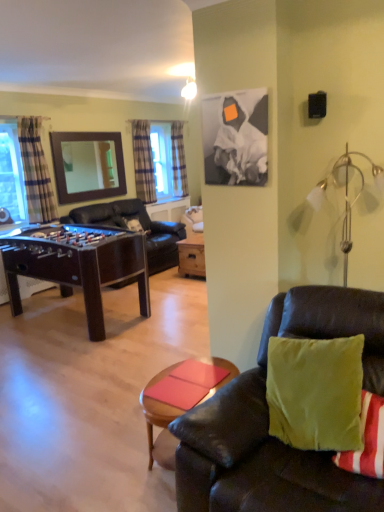
Question: Is plaid fabric curtain at center, positioned as the 2th curtain in back-to-front order, far away from mahogany wood foosball table at left?

Choices:
 (A) yes
 (B) no

Answer: (A)

Question: Does plaid fabric curtain at center, positioned as the 2th curtain in back-to-front order, lie behind mahogany wood foosball table at left?

Choices:
 (A) no
 (B) yes

Answer: (B)

Question: Does plaid fabric curtain at center, positioned as the 2th curtain in back-to-front order, contain mahogany wood foosball table at left?

Choices:
 (A) no
 (B) yes

Answer: (A)

Question: Can you confirm if plaid fabric curtain at center, marked as the second curtain in a front-to-back arrangement, is positioned to the left of mahogany wood foosball table at left?

Choices:
 (A) no
 (B) yes

Answer: (A)

Question: From the image's perspective, does plaid fabric curtain at center, the second curtain in the left-to-right sequence, appear lower than mahogany wood foosball table at left?

Choices:
 (A) no
 (B) yes

Answer: (A)

Question: Is wooden mirror at upper left wider or thinner than dark brown leather couch at center, acting as the 1th studio couch starting from the back?

Choices:
 (A) thin
 (B) wide

Answer: (A)

Question: Looking at the image, does wooden mirror at upper left seem bigger or smaller compared to dark brown leather couch at center, positioned as the second studio couch in front-to-back order?

Choices:
 (A) small
 (B) big

Answer: (A)

Question: Considering the positions of point (119, 178) and point (145, 221), is point (119, 178) closer or farther from the camera than point (145, 221)?

Choices:
 (A) closer
 (B) farther

Answer: (B)

Question: From a real-world perspective, relative to dark brown leather couch at center, acting as the 1th studio couch starting from the back, is wooden mirror at upper left vertically above or below?

Choices:
 (A) above
 (B) below

Answer: (A)

Question: Considering their positions, is clear glass window at left located in front of or behind smooth wooden coffee table at lower center?

Choices:
 (A) front
 (B) behind

Answer: (B)

Question: Considering the positions of clear glass window at left and smooth wooden coffee table at lower center in the image, is clear glass window at left wider or thinner than smooth wooden coffee table at lower center?

Choices:
 (A) thin
 (B) wide

Answer: (A)

Question: From the image's perspective, is clear glass window at left positioned above or below smooth wooden coffee table at lower center?

Choices:
 (A) above
 (B) below

Answer: (A)

Question: Is point (1, 154) positioned closer to the camera than point (140, 403)?

Choices:
 (A) closer
 (B) farther

Answer: (B)

Question: From the image's perspective, is wooden mirror at upper left located above or below white glass lamp at upper right?

Choices:
 (A) above
 (B) below

Answer: (A)

Question: From a real-world perspective, is wooden mirror at upper left physically located above or below white glass lamp at upper right?

Choices:
 (A) below
 (B) above

Answer: (B)